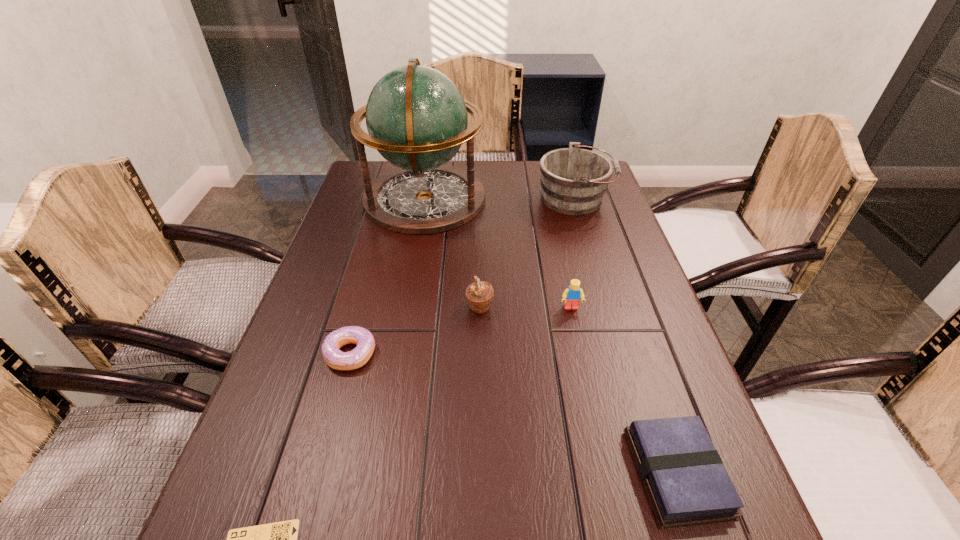
I want to click on vacant space at the far edge of the desktop, so point(537,192).

The height and width of the screenshot is (540, 960). I want to click on vacant space at the left edge of the desktop, so click(253, 475).

The image size is (960, 540). I want to click on vacant space at the right edge of the desktop, so click(x=606, y=208).

Locate an element on the screen. blank space at the far left corner of the desktop is located at coordinates (385, 164).

Identify the location of vacant point located between the Lego and the third nearest object. The width and height of the screenshot is (960, 540). (461, 330).

Image resolution: width=960 pixels, height=540 pixels. Find the location of `vacant area that lies between the Lego and the muffin`. vacant area that lies between the Lego and the muffin is located at coordinates (525, 307).

Where is `vacant region between the fifth farthest object and the Lego`? The image size is (960, 540). vacant region between the fifth farthest object and the Lego is located at coordinates (461, 330).

Find the location of a particular element. This screenshot has height=540, width=960. unoccupied position between the Lego and the book is located at coordinates (624, 390).

Find the location of a particular element. The height and width of the screenshot is (540, 960). vacant space in between the wine bucket and the book is located at coordinates (626, 336).

At what (x,y) coordinates should I click in order to perform the action: click on vacant area that lies between the muffin and the second tallest object. Please return your answer as a coordinate pair (x, y). The width and height of the screenshot is (960, 540). Looking at the image, I should click on (527, 253).